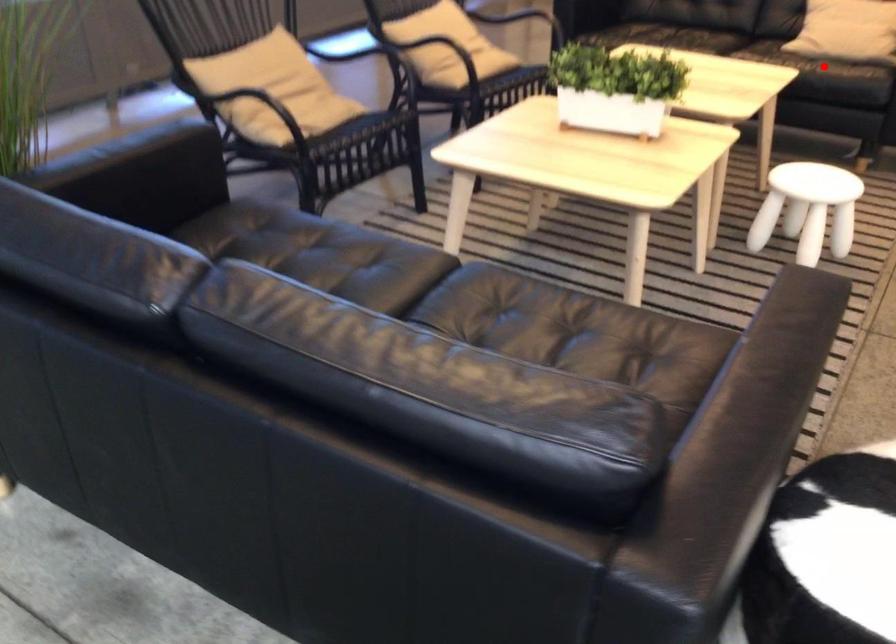
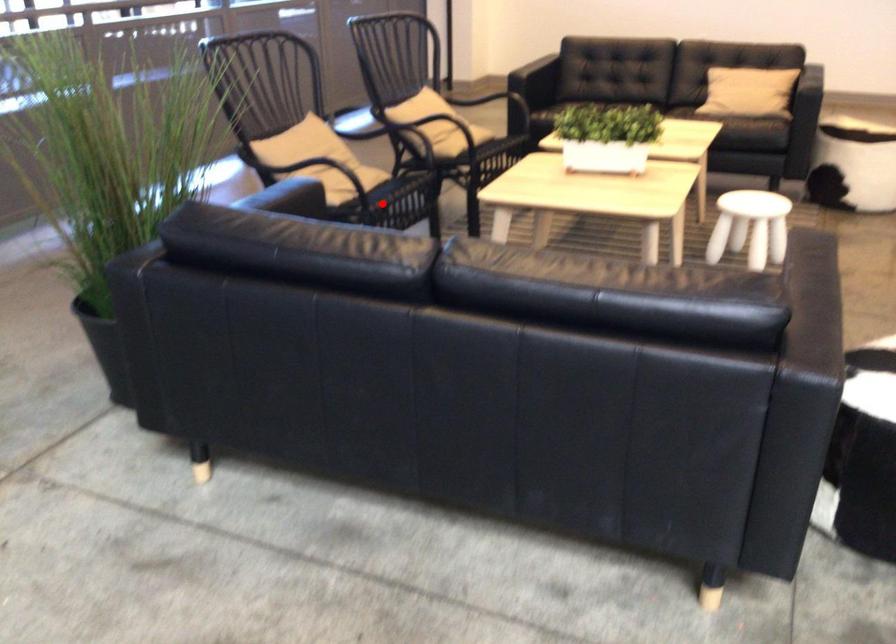
I am providing you with two images of the same scene from different viewpoints. A red point is marked on the first image and another point is marked on the second image. Is the marked point in image1 the same physical position as the marked point in image2?

No